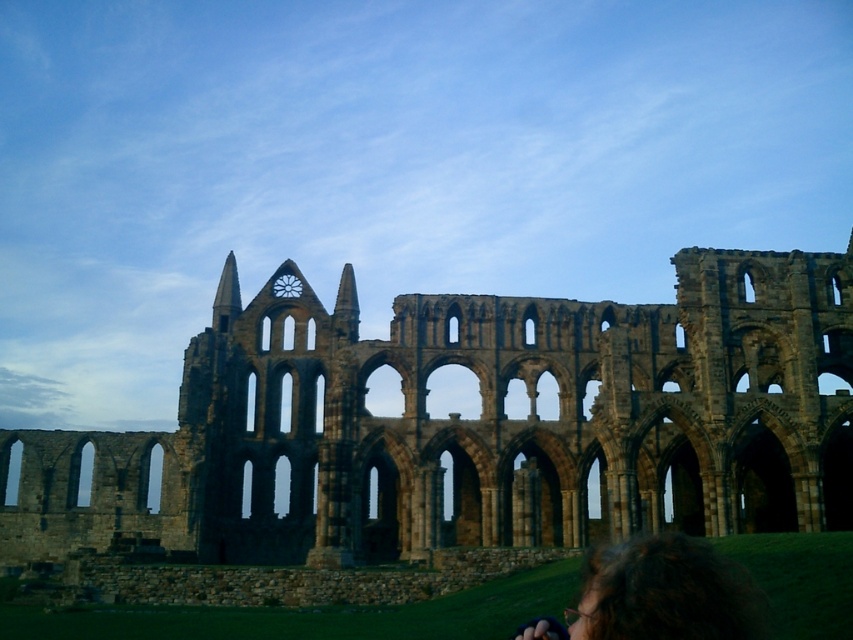
You are standing in front of the ruins of Whitby Abbey. You notice the brown stone ruins at center and the dark brown hair at lower right. Which object is positioned to the east if the sun is setting in the west?

The dark brown hair at lower right is positioned to the east because the brown stone ruins at center is to the left of it, and since the sun is setting in the west, the left side would be east.